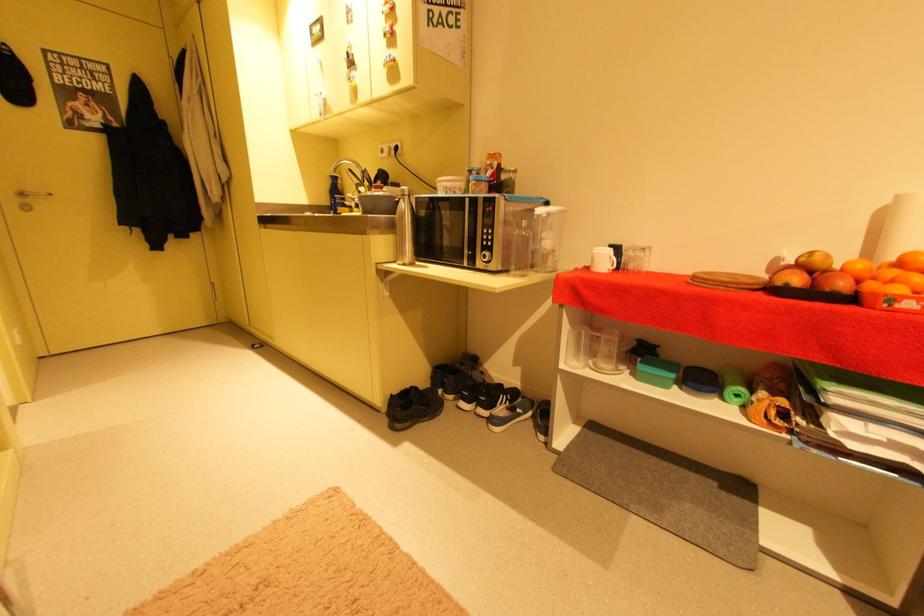
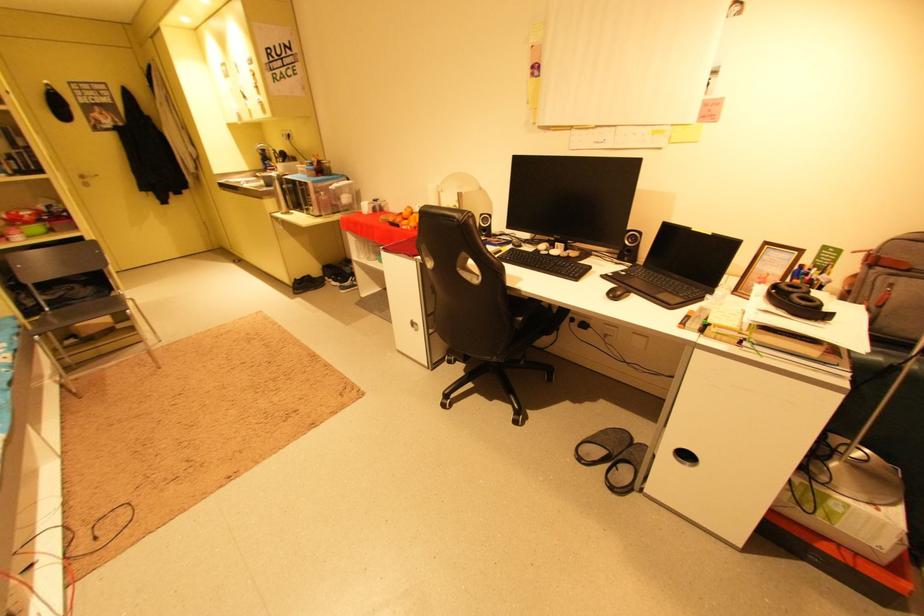
Find the pixel in the second image that matches point (35, 201) in the first image.

(93, 180)